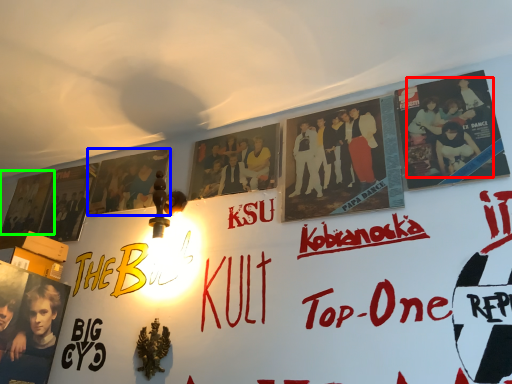
Question: Which object is positioned farthest from person (highlighted by a red box)? Select from poster (highlighted by a blue box) and movie poster (highlighted by a green box).

Choices:
 (A) poster
 (B) movie poster

Answer: (B)